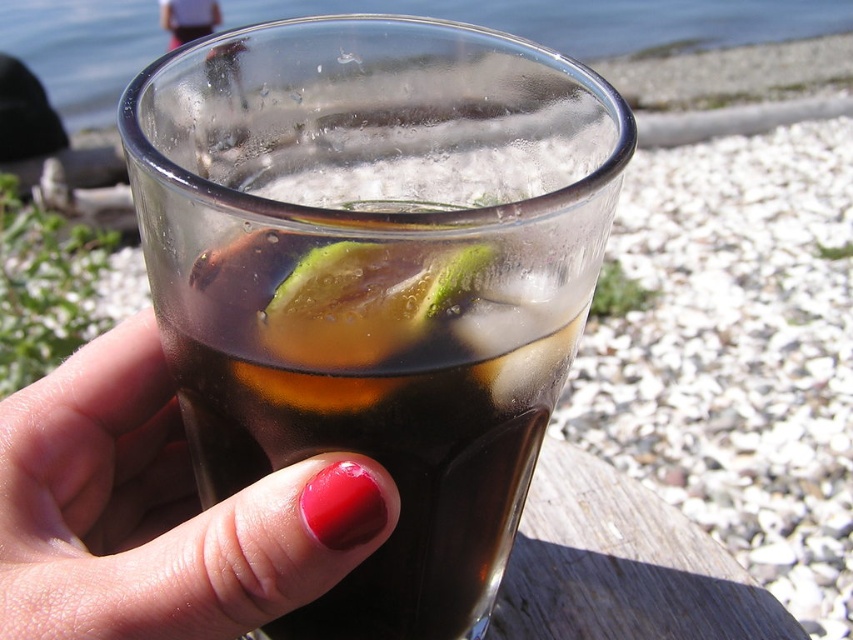
You are a photographer trying to capture the reflection of the dark glass at center in the glossy nail polish at center. Based on their positions, is this possible?

The dark glass at center is above the glossy nail polish at center, so the reflection of the dark glass at center can be seen in the glossy nail polish at center because the nail polish is positioned below the glass.

You are standing at the point marked as point [376,276] in the image. What object is located exactly at that point?

The dark glass at center is located exactly at point [376,276].